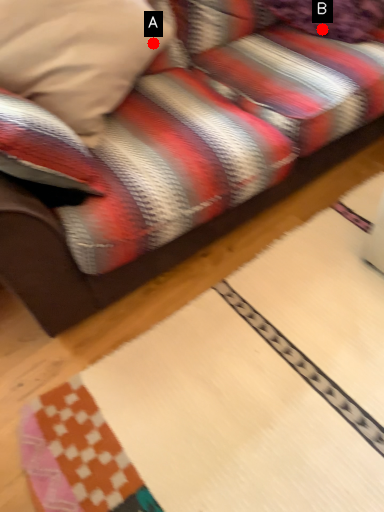
Question: Two points are circled on the image, labeled by A and B beside each circle. Which point is closer to the camera?

Choices:
 (A) A is closer
 (B) B is closer

Answer: (A)